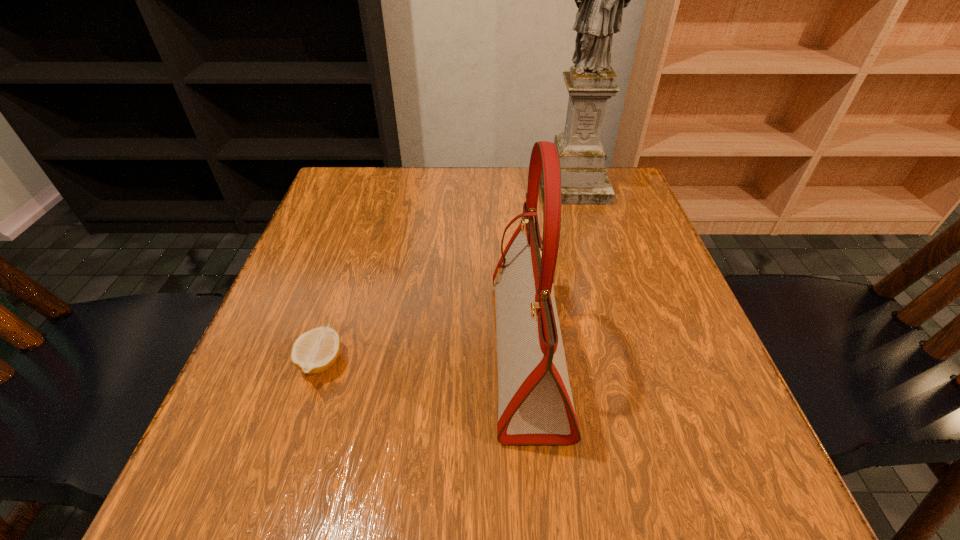
You are a GUI agent. You are given a task and a screenshot of the screen. Output one action in this format:
    pyautogui.click(x=<x>, y=<y>)
    Task: Click on the free space at the near right corner of the desktop
    
    Given the screenshot: What is the action you would take?
    pyautogui.click(x=687, y=497)

Where is `free point between the leftmost object and the farthest object`? This screenshot has width=960, height=540. free point between the leftmost object and the farthest object is located at coordinates (447, 274).

What are the coordinates of `vacant space in between the second tallest object and the lemon` in the screenshot? It's located at (425, 357).

Find the location of `vacant area that lies between the rightmost object and the leftmost object`. vacant area that lies between the rightmost object and the leftmost object is located at coordinates (447, 274).

Locate an element on the screen. The width and height of the screenshot is (960, 540). vacant area that lies between the shortest object and the second tallest object is located at coordinates pyautogui.click(x=425, y=357).

Find the location of `free space between the leftmost object and the tallest object`. free space between the leftmost object and the tallest object is located at coordinates (447, 274).

The image size is (960, 540). I want to click on empty space between the shortest object and the second shortest object, so click(x=425, y=357).

Locate an element on the screen. The width and height of the screenshot is (960, 540). free point between the leftmost object and the tallest object is located at coordinates (447, 274).

Identify which object is located as the nearest to the sculpture. Please provide its 2D coordinates. Your answer should be formatted as a tuple, i.e. [(x, y)], where the tuple contains the x and y coordinates of a point satisfying the conditions above.

[(535, 406)]

Where is `object that is the second closest one to the farthest object`? This screenshot has height=540, width=960. object that is the second closest one to the farthest object is located at coordinates pyautogui.click(x=314, y=351).